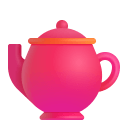
Find the location of a particular element. The width and height of the screenshot is (128, 128). teapot pourer is located at coordinates (12, 44).